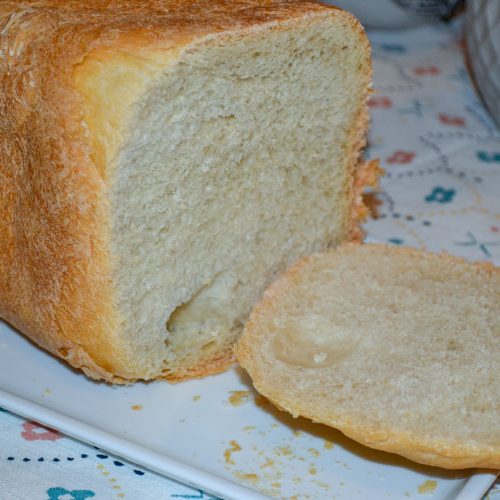
What are the coordinates of `blue patter design on tablecloth` in the screenshot? It's located at (80, 493), (448, 197), (490, 158), (397, 49), (400, 241).